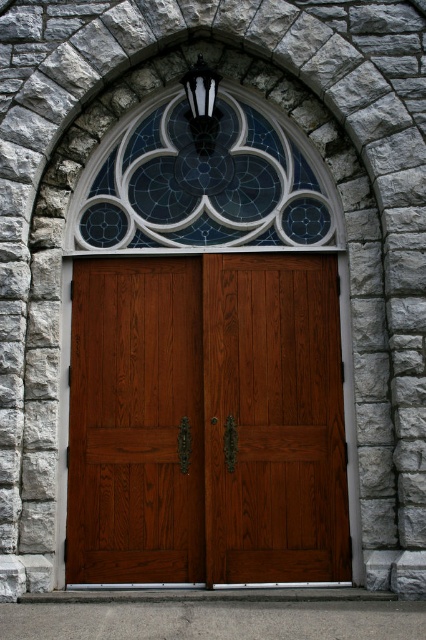
Question: Which point is farther to the camera?

Choices:
 (A) (124, 160)
 (B) (69, 467)

Answer: (A)

Question: Is satin wood doors at center above stained glass window at upper center?

Choices:
 (A) yes
 (B) no

Answer: (B)

Question: Which of the following is the closest to the observer?

Choices:
 (A) (77, 452)
 (B) (293, 209)

Answer: (A)

Question: In this image, where is satin wood doors at center located relative to stained glass window at upper center?

Choices:
 (A) below
 (B) above

Answer: (A)

Question: From the image, what is the correct spatial relationship of satin wood doors at center in relation to stained glass window at upper center?

Choices:
 (A) left
 (B) right

Answer: (B)